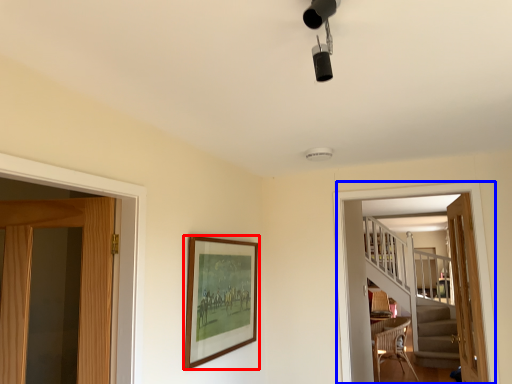
Question: Among these objects, which one is farthest to the camera, picture frame (highlighted by a red box) or screen door (highlighted by a blue box)?

Choices:
 (A) picture frame
 (B) screen door

Answer: (B)